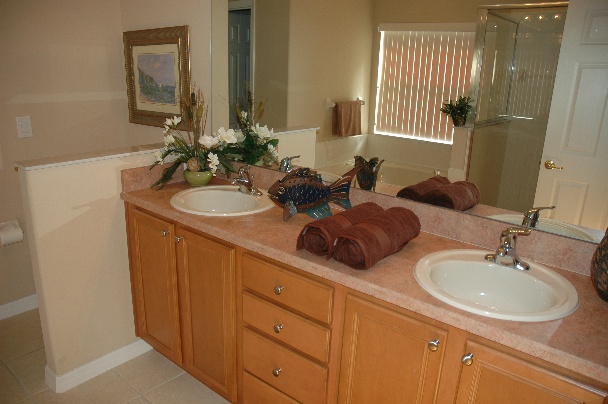
Image resolution: width=608 pixels, height=404 pixels. I want to click on light switch, so click(22, 122).